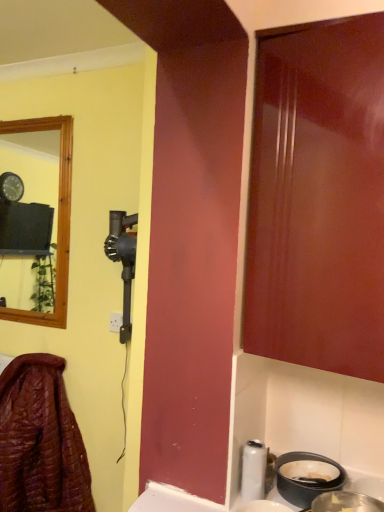
Question: From the image's perspective, is metallic silver basin at lower right located above or below leather jacket at lower left?

Choices:
 (A) below
 (B) above

Answer: (B)

Question: Would you say metallic silver basin at lower right is to the left or to the right of leather jacket at lower left in the picture?

Choices:
 (A) right
 (B) left

Answer: (A)

Question: Which is correct: metallic silver basin at lower right is inside leather jacket at lower left, or outside of it?

Choices:
 (A) inside
 (B) outside

Answer: (B)

Question: In terms of height, does leather jacket at lower left look taller or shorter compared to metallic silver basin at lower right?

Choices:
 (A) short
 (B) tall

Answer: (B)

Question: Is point (0, 501) closer or farther from the camera than point (355, 493)?

Choices:
 (A) closer
 (B) farther

Answer: (B)

Question: Considering their positions, is leather jacket at lower left located in front of or behind metallic silver basin at lower right?

Choices:
 (A) behind
 (B) front

Answer: (A)

Question: From the image's perspective, relative to metallic silver basin at lower right, is leather jacket at lower left above or below?

Choices:
 (A) below
 (B) above

Answer: (A)